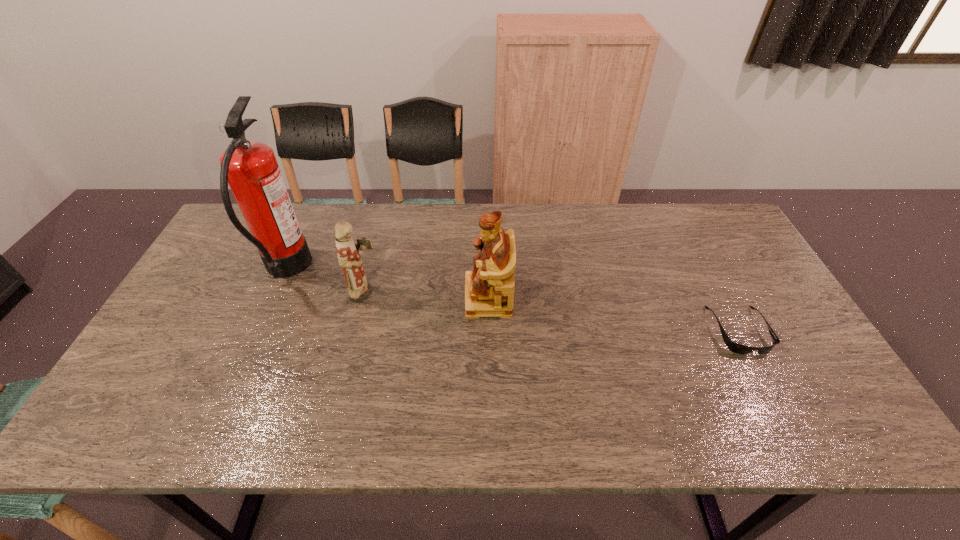
Where is `free space located 0.380m on the front-facing side of the second object from left to right`? The height and width of the screenshot is (540, 960). free space located 0.380m on the front-facing side of the second object from left to right is located at coordinates (513, 293).

You are a GUI agent. You are given a task and a screenshot of the screen. Output one action in this format:
    pyautogui.click(x=<x>, y=<y>)
    Task: Click on the free space located on the front-facing side of the shortest object
    The width and height of the screenshot is (960, 540).
    Given the screenshot: What is the action you would take?
    pyautogui.click(x=769, y=387)

In order to click on object present at the far edge in this screenshot , I will do `click(250, 168)`.

At what (x,y) coordinates should I click in order to perform the action: click on object that is at the right edge. Please return your answer as a coordinate pair (x, y). Looking at the image, I should click on (734, 347).

In the image, there is a desktop. Identify the location of vacant region at the far edge. This screenshot has height=540, width=960. (671, 246).

Identify the location of vacant region at the near edge of the desktop. The height and width of the screenshot is (540, 960). (350, 419).

Image resolution: width=960 pixels, height=540 pixels. Identify the location of free space at the left edge of the desktop. (208, 362).

Where is `vacant space at the right edge of the desktop`? vacant space at the right edge of the desktop is located at coordinates tap(769, 306).

Find the location of `free point between the right figurine and the shortest object`. free point between the right figurine and the shortest object is located at coordinates (613, 314).

This screenshot has width=960, height=540. Identify the location of empty space between the third object from left to right and the shortest object. (613, 314).